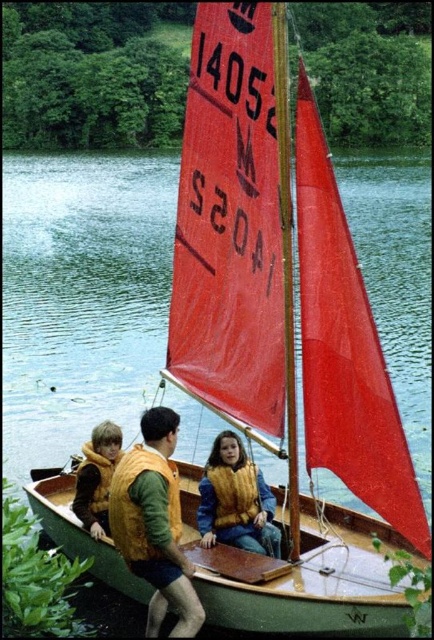
Is green wood canoe at lower center below orange life vest at center?

Yes.

Locate an element on the screen. The width and height of the screenshot is (434, 640). green wood canoe at lower center is located at coordinates (312, 580).

Does yellow textured life vest at center appear over yellow fuzzy vest at left?

No, yellow textured life vest at center is not above yellow fuzzy vest at left.

In the scene shown: Is yellow textured life vest at center smaller than yellow fuzzy vest at left?

No.

Locate an element on the screen. The image size is (434, 640). yellow textured life vest at center is located at coordinates (236, 500).

Locate an element on the screen. Image resolution: width=434 pixels, height=640 pixels. yellow textured life vest at center is located at coordinates (236, 500).

Consider the image. Who is positioned more to the left, green wood canoe at lower center or yellow textured life vest at center?

Positioned to the left is green wood canoe at lower center.

Find the location of a particular element. green wood canoe at lower center is located at coordinates (312, 580).